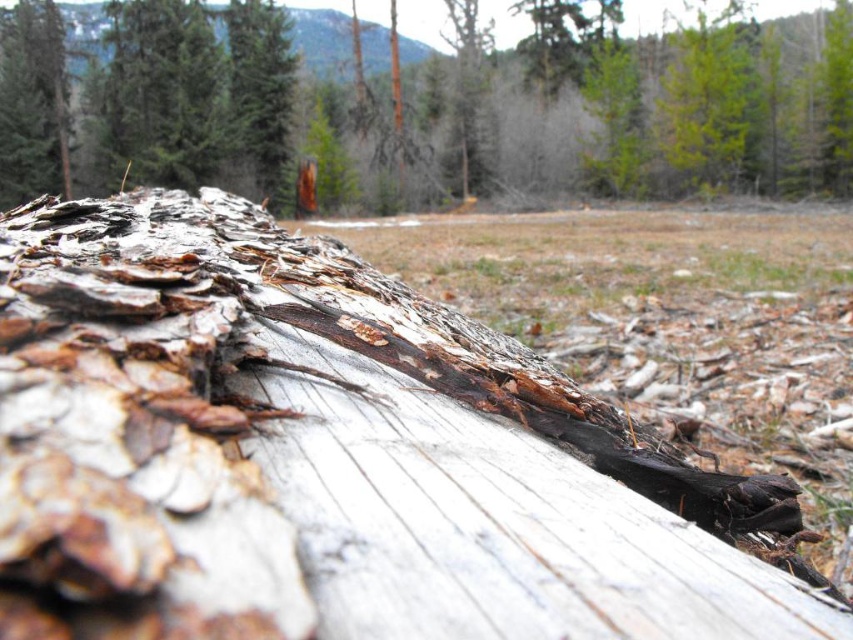
Question: Considering the relative positions of weathered wood at center and brown textured bark at center in the image provided, where is weathered wood at center located with respect to brown textured bark at center?

Choices:
 (A) right
 (B) left

Answer: (B)

Question: Is weathered wood at center wider than brown textured bark at center?

Choices:
 (A) no
 (B) yes

Answer: (A)

Question: Which point appears closest to the camera in this image?

Choices:
 (A) (171, 19)
 (B) (614, 486)

Answer: (B)

Question: Among these objects, which one is nearest to the camera?

Choices:
 (A) weathered wood at center
 (B) brown textured bark at center

Answer: (A)

Question: Which object appears closest to the camera in this image?

Choices:
 (A) brown textured bark at center
 (B) weathered wood at center

Answer: (B)

Question: Can you confirm if weathered wood at center is thinner than brown textured bark at center?

Choices:
 (A) no
 (B) yes

Answer: (B)